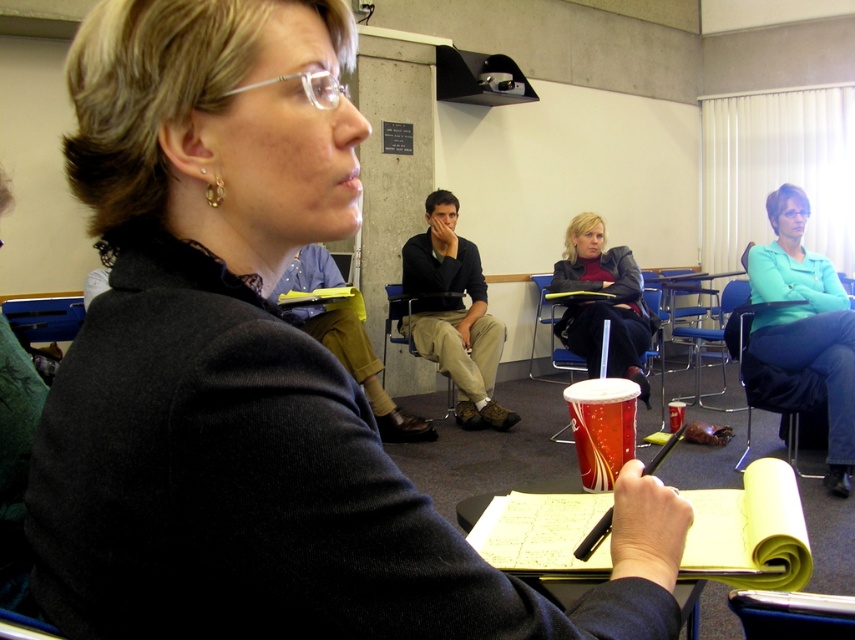
Can you confirm if blue fabric chair at right is positioned to the left of metallic blue chair at center?

Yes, blue fabric chair at right is to the left of metallic blue chair at center.

Is point (789, 449) farther from viewer compared to point (685, 284)?

No, (789, 449) is closer to viewer.

Measure the distance between blue fabric chair at right and camera.

blue fabric chair at right is 3.28 meters away from camera.

Where is `blue fabric chair at right`? The width and height of the screenshot is (855, 640). blue fabric chair at right is located at coordinates (777, 387).

Is the position of matte black jacket at center less distant than that of matte plastic chair at center?

Yes, matte black jacket at center is in front of matte plastic chair at center.

Does matte black jacket at center appear on the left side of matte plastic chair at center?

Incorrect, matte black jacket at center is not on the left side of matte plastic chair at center.

Find the location of `matte black jacket at center`. matte black jacket at center is located at coordinates (602, 301).

In order to click on matte black jacket at center in this screenshot , I will do `click(602, 301)`.

Is teal sweater at right to the right of matte plastic chair at center from the viewer's perspective?

Indeed, teal sweater at right is positioned on the right side of matte plastic chair at center.

Is point (773, 272) positioned after point (394, 300)?

No, (773, 272) is in front of (394, 300).

Locate an element on the screen. The width and height of the screenshot is (855, 640). teal sweater at right is located at coordinates (805, 323).